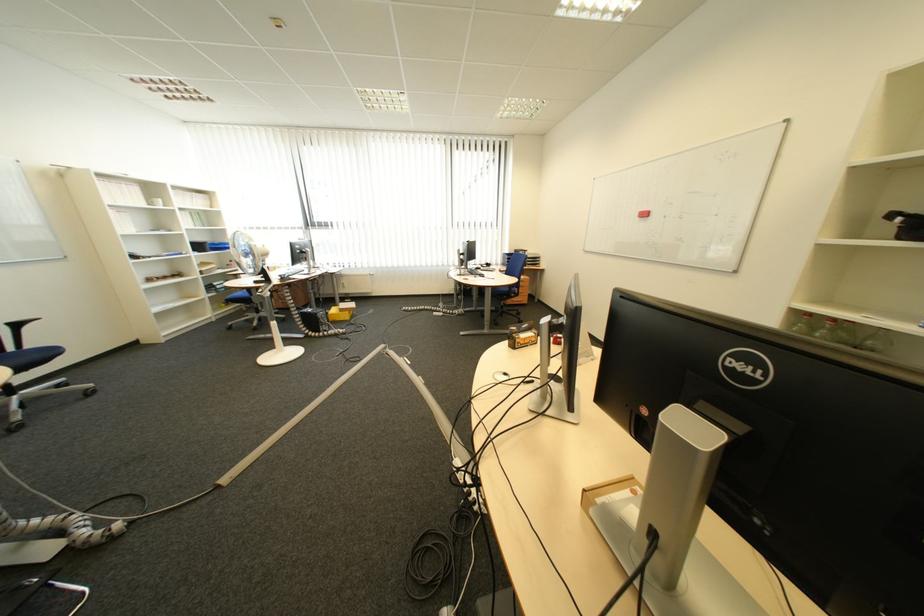
Find the location of a particular element. blue chair sitting surface is located at coordinates (30, 374).